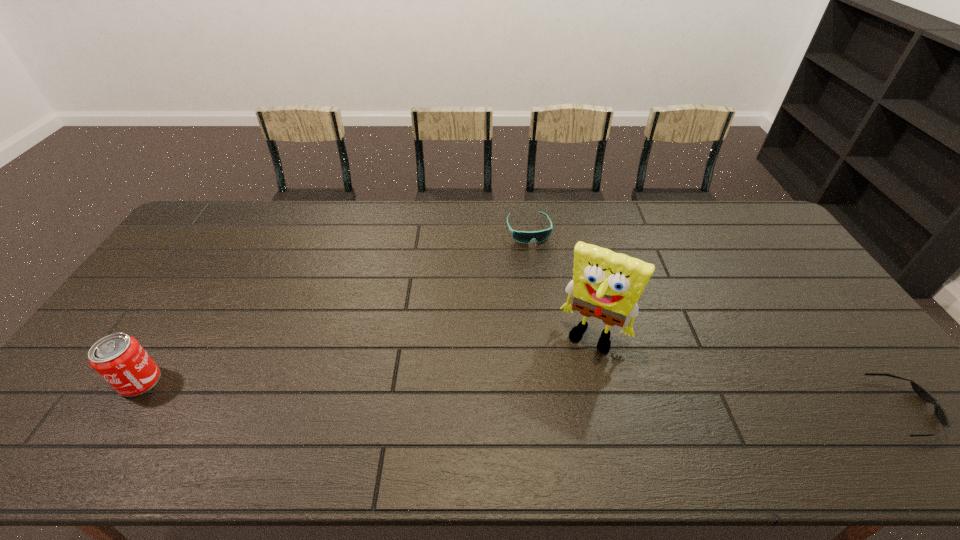
Image resolution: width=960 pixels, height=540 pixels. In order to click on unoccupied area between the shorter sunglasses and the second tallest object in this screenshot , I will do `click(523, 395)`.

The image size is (960, 540). I want to click on unoccupied area between the taller sunglasses and the shortest object, so click(x=717, y=319).

Find the location of a particular element. This screenshot has width=960, height=540. empty space that is in between the sponge and the shorter sunglasses is located at coordinates (750, 372).

At what (x,y) coordinates should I click in order to perform the action: click on empty space between the sponge and the second tallest object. Please return your answer as a coordinate pair (x, y). Looking at the image, I should click on (367, 359).

Locate an element on the screen. free point between the leftmost object and the farther sunglasses is located at coordinates (334, 306).

Locate an element on the screen. The height and width of the screenshot is (540, 960). empty location between the right sunglasses and the farthest object is located at coordinates point(717,319).

Identify which object is the nearest to the tallest object. Please provide its 2D coordinates. Your answer should be formatted as a tuple, i.e. [(x, y)], where the tuple contains the x and y coordinates of a point satisfying the conditions above.

[(525, 237)]

I want to click on object that is the second closest to the second tallest object, so click(607, 285).

Locate an element on the screen. Image resolution: width=960 pixels, height=540 pixels. free space that satisfies the following two spatial constraints: 1. on the back side of the tallest object; 2. on the right side of the can is located at coordinates (170, 335).

I want to click on vacant region that satisfies the following two spatial constraints: 1. on the front side of the sponge; 2. on the left side of the farther sunglasses, so click(542, 335).